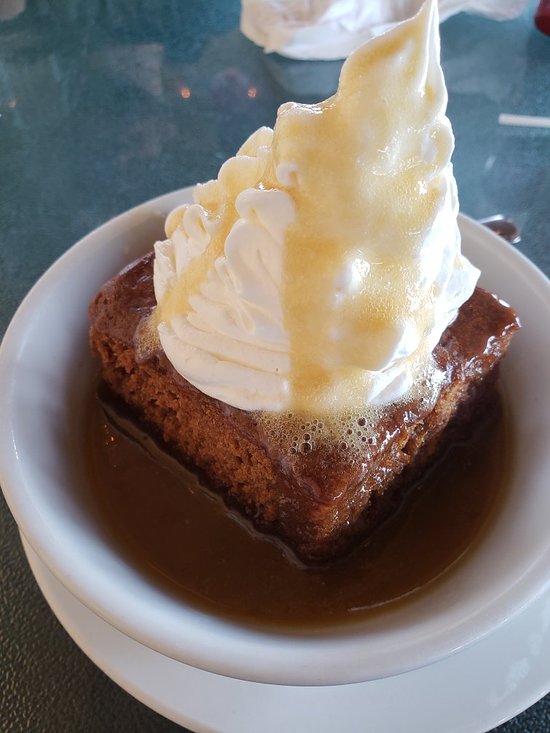
What are the coordinates of `foam` in the screenshot? It's located at (302, 440).